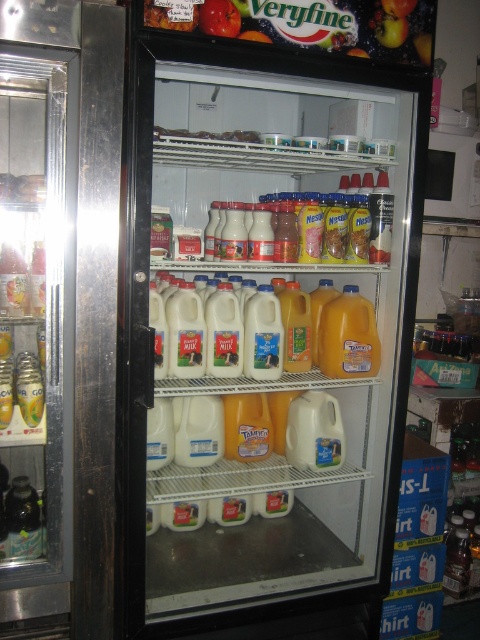
You are a store employee who needs to stack the white plastic milk jugs at center and the translucent plastic jug at center right on a shelf. Which one should you place at the bottom to ensure stability?

The white plastic milk jugs at center is much taller than the translucent plastic jug at center right, so placing the taller milk jug at the bottom would provide better stability.

You are a store employee restocking the refrigerated display case. You need to place a new orange juice carton between the white plastic milk jugs at center and the translucent plastic jug at center right. Is there enough space between them to fit the carton?

The white plastic milk jugs at center are to the left of the translucent plastic jug at center right, so there is space between them to place the new orange juice carton.

You are a store employee who needs to restock the refrigerated display case. You have a new shipment of milk jugs that are 14 inches wide. There is a space between the white plastic milk jugs at center and the translucent plastic jug at center right. Can the new milk jug fit in that space?

The space between the white plastic milk jugs at center and the translucent plastic jug at center right is 13.51 inches. Since the new milk jug is 14 inches wide, it cannot fit in the space between them because it is slightly wider than the available gap.